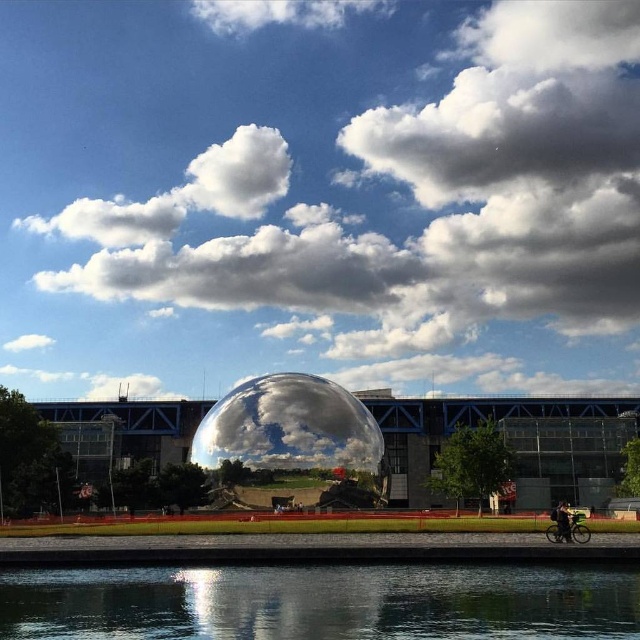
You are an architect analyzing the reflection in the polished metallic sphere at center. Based on the reflection, can you determine if the white fluffy cloud at center is above or below the sphere?

The white fluffy cloud at center is located above the polished metallic sphere at center, so its reflection would show it mirrored below the sphere in the reflection.

You are an architect designing a new sculpture garden. You want to place a new sculpture between the white fluffy cloud at center and the polished metallic sphere at center. What is the minimum distance you need to maintain between them to ensure the sculpture fits?

The white fluffy cloud at center and polished metallic sphere at center are 45.73 meters apart, so the minimum distance required for the sculpture would be less than 45.73 meters to fit between them.

You are standing in front of the polished metallic sphere at center and want to take a photo of it. If your camera has a maximum focus range of 100 meters, will you be able to capture it clearly?

The polished metallic sphere at center is 88.61 meters away from the viewer. Since the camera can focus up to 100 meters, the distance is within the camera range, so yes, you can capture it clearly.